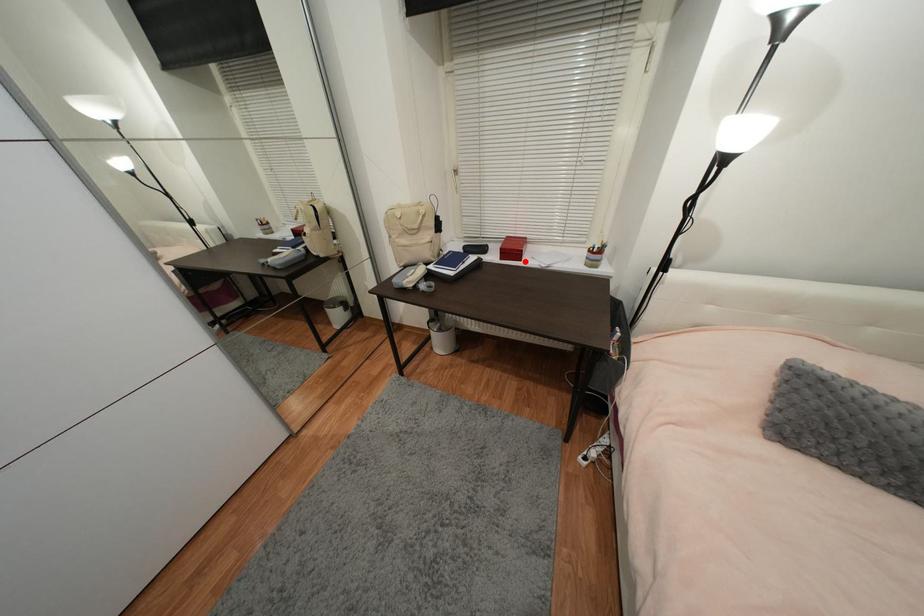
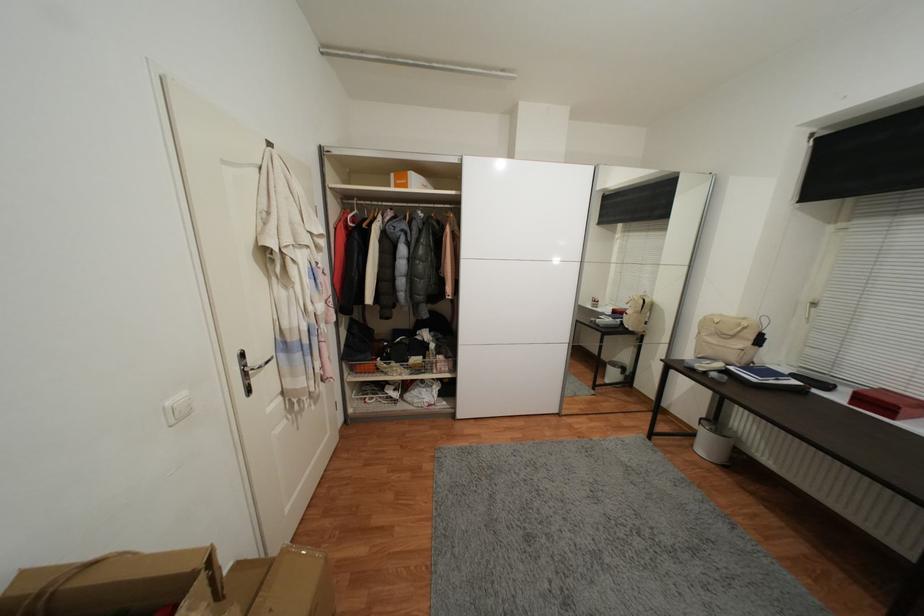
Where in the second image is the point corresponding to the highlighted location from the first image?

(897, 419)